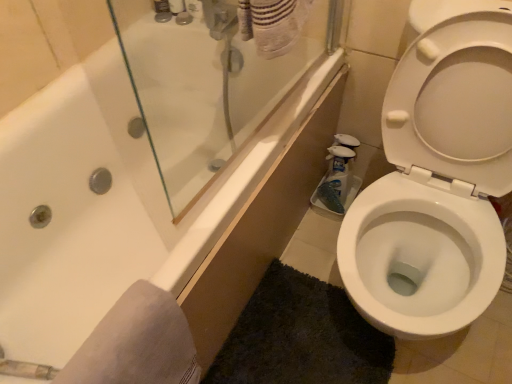
Where is `empty space that is ontop of gray soft towel at lower left`? empty space that is ontop of gray soft towel at lower left is located at coordinates (124, 336).